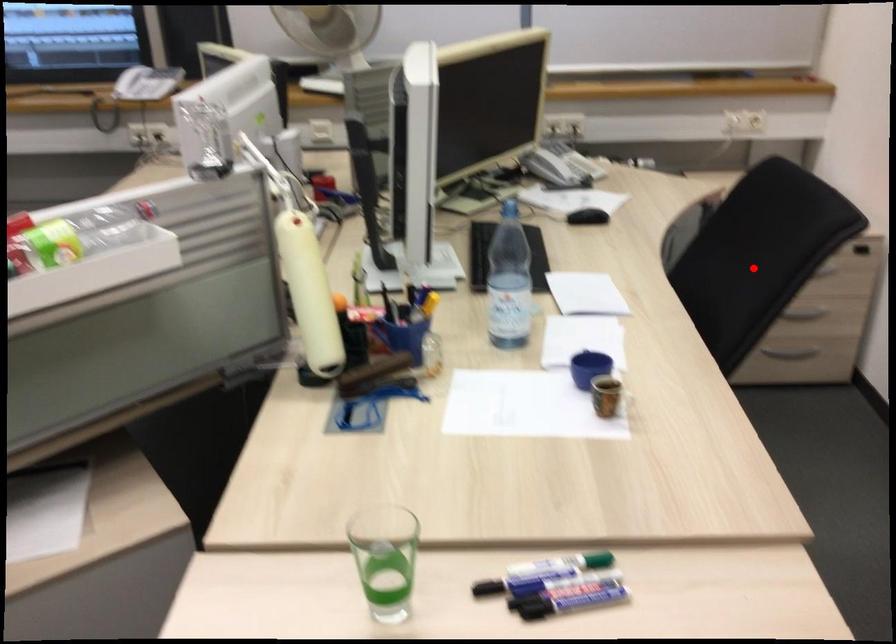
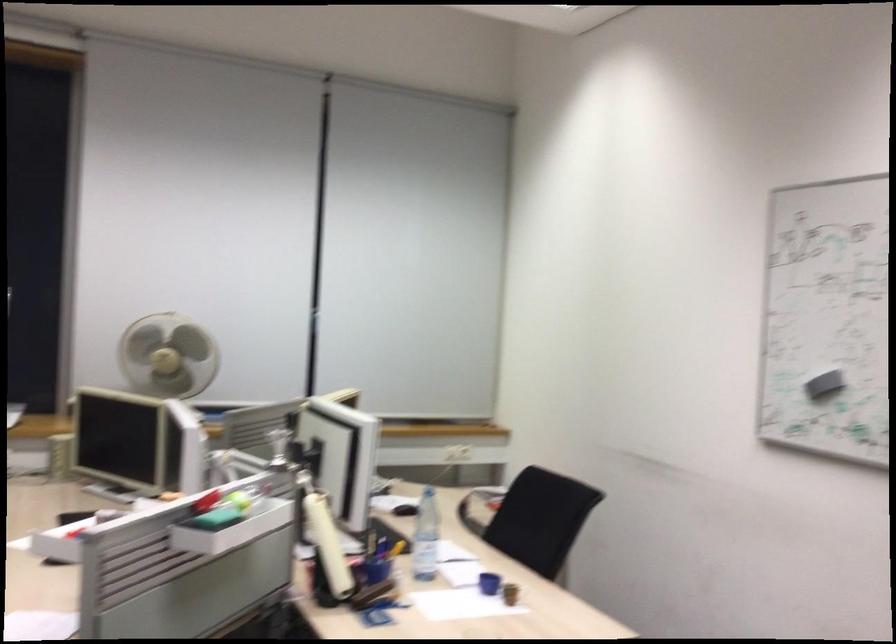
Question: I am providing you with two images of the same scene from different viewpoints. Image1 has a red point marked. In image2, the corresponding 3D location appears at what relative position? Reply with the corresponding letter.

Choices:
 (A) Closer
 (B) Farther

Answer: (B)